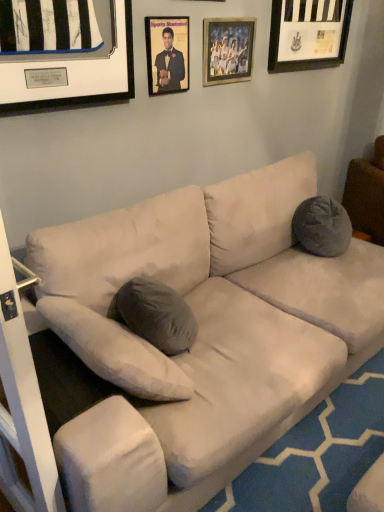
Where is `gray fabric pillow at right`? gray fabric pillow at right is located at coordinates (366, 195).

The width and height of the screenshot is (384, 512). What are the coordinates of `black matte picture frame at upper right, which is the 3th picture frame from left to right` in the screenshot? It's located at (308, 34).

Between matte black frame at upper center, which is the 3th picture frame in right-to-left order, and wooden picture frame at upper center, the second picture frame positioned from the left, which one has more height?

With more height is matte black frame at upper center, which is the 3th picture frame in right-to-left order.

In the scene shown: Who is more distant, matte black frame at upper center, which is the 3th picture frame in right-to-left order, or wooden picture frame at upper center, which appears as the second picture frame when viewed from the right?

wooden picture frame at upper center, which appears as the second picture frame when viewed from the right, is further away from the camera.

Considering the sizes of objects matte black frame at upper center, which is the 3th picture frame in right-to-left order, and wooden picture frame at upper center, the second picture frame positioned from the left, in the image provided, who is thinner, matte black frame at upper center, which is the 3th picture frame in right-to-left order, or wooden picture frame at upper center, the second picture frame positioned from the left,?

Thinner between the two is wooden picture frame at upper center, the second picture frame positioned from the left.

Can we say matte black frame at upper center, which ranks as the 1th picture frame in left-to-right order, lies outside wooden picture frame at upper center, the second picture frame positioned from the left?

Yes, matte black frame at upper center, which ranks as the 1th picture frame in left-to-right order, is outside of wooden picture frame at upper center, the second picture frame positioned from the left.

Is gray fabric pillow at right at the left side of matte black frame at upper center, which ranks as the 1th picture frame in left-to-right order?

No.

From a real-world perspective, is gray fabric pillow at right on top of matte black frame at upper center, which ranks as the 1th picture frame in left-to-right order?

No, from a real-world perspective, gray fabric pillow at right is not above matte black frame at upper center, which ranks as the 1th picture frame in left-to-right order.

What's the angular difference between gray fabric pillow at right and matte black frame at upper center, which ranks as the 1th picture frame in left-to-right order,'s facing directions?

The angle between the facing direction of gray fabric pillow at right and the facing direction of matte black frame at upper center, which ranks as the 1th picture frame in left-to-right order, is 32.7 degrees.

Would you say gray fabric pillow at right is outside matte black frame at upper center, which ranks as the 1th picture frame in left-to-right order?

Absolutely, gray fabric pillow at right is external to matte black frame at upper center, which ranks as the 1th picture frame in left-to-right order.

Is gray fabric pillow at right oriented away from wooden picture frame at upper center, the second picture frame positioned from the left?

No, wooden picture frame at upper center, the second picture frame positioned from the left, is not at the back of gray fabric pillow at right.

Is gray fabric pillow at right inside the boundaries of wooden picture frame at upper center, which appears as the second picture frame when viewed from the right, or outside?

gray fabric pillow at right exists outside the volume of wooden picture frame at upper center, which appears as the second picture frame when viewed from the right.

Which of these two, gray fabric pillow at right or wooden picture frame at upper center, the second picture frame positioned from the left, is wider?

gray fabric pillow at right.

Based on the photo, is black matte picture frame at upper right, which ranks as the 1th picture frame in right-to-left order, in contact with wooden picture frame at upper center, the second picture frame positioned from the left?

They are not placed beside each other.

Is black matte picture frame at upper right, which ranks as the 1th picture frame in right-to-left order, taller than wooden picture frame at upper center, which appears as the second picture frame when viewed from the right?

Indeed, black matte picture frame at upper right, which ranks as the 1th picture frame in right-to-left order, has a greater height compared to wooden picture frame at upper center, which appears as the second picture frame when viewed from the right.

Where is `the 1st picture frame to the left of the black matte picture frame at upper right, which is the 3th picture frame from left to right, starting your count from the anchor`? This screenshot has width=384, height=512. the 1st picture frame to the left of the black matte picture frame at upper right, which is the 3th picture frame from left to right, starting your count from the anchor is located at coordinates (227, 50).

In terms of height, does matte black frame at upper center, which ranks as the 1th picture frame in left-to-right order, look taller or shorter compared to gray fabric pillow at right?

Considering their sizes, matte black frame at upper center, which ranks as the 1th picture frame in left-to-right order, has less height than gray fabric pillow at right.

The width and height of the screenshot is (384, 512). There is a gray fabric pillow at right. Find the location of `the 1st picture frame above it (from the image's perspective)`. the 1st picture frame above it (from the image's perspective) is located at coordinates (167, 54).

Does matte black frame at upper center, which ranks as the 1th picture frame in left-to-right order, have a lesser width compared to gray fabric pillow at right?

Yes.

In the scene shown: Does matte black frame at upper center, which is the 3th picture frame in right-to-left order, turn towards gray fabric pillow at right?

No, matte black frame at upper center, which is the 3th picture frame in right-to-left order, is not turned towards gray fabric pillow at right.

From a real-world perspective, is matte black frame at upper center, which ranks as the 1th picture frame in left-to-right order, physically located above or below black matte picture frame at upper right, which is the 3th picture frame from left to right?

From a real-world perspective, matte black frame at upper center, which ranks as the 1th picture frame in left-to-right order, is physically below black matte picture frame at upper right, which is the 3th picture frame from left to right.

Can you tell me how much matte black frame at upper center, which is the 3th picture frame in right-to-left order, and black matte picture frame at upper right, which is the 3th picture frame from left to right, differ in facing direction?

The angle between the facing direction of matte black frame at upper center, which is the 3th picture frame in right-to-left order, and the facing direction of black matte picture frame at upper right, which is the 3th picture frame from left to right, is 0.00786 degrees.

Is matte black frame at upper center, which ranks as the 1th picture frame in left-to-right order, oriented towards black matte picture frame at upper right, which ranks as the 1th picture frame in right-to-left order?

No, matte black frame at upper center, which ranks as the 1th picture frame in left-to-right order, is not oriented towards black matte picture frame at upper right, which ranks as the 1th picture frame in right-to-left order.

Is matte black frame at upper center, which ranks as the 1th picture frame in left-to-right order, taller or shorter than black matte picture frame at upper right, which is the 3th picture frame from left to right?

Clearly, matte black frame at upper center, which ranks as the 1th picture frame in left-to-right order, is shorter compared to black matte picture frame at upper right, which is the 3th picture frame from left to right.

Are wooden picture frame at upper center, the second picture frame positioned from the left, and black matte picture frame at upper right, which is the 3th picture frame from left to right, beside each other?

wooden picture frame at upper center, the second picture frame positioned from the left, and black matte picture frame at upper right, which is the 3th picture frame from left to right, are clearly separated.

Can black matte picture frame at upper right, which is the 3th picture frame from left to right, be found inside wooden picture frame at upper center, which appears as the second picture frame when viewed from the right?

No.

Visually, is wooden picture frame at upper center, the second picture frame positioned from the left, positioned to the left or to the right of black matte picture frame at upper right, which is the 3th picture frame from left to right?

→ wooden picture frame at upper center, the second picture frame positioned from the left, is positioned on black matte picture frame at upper right, which is the 3th picture frame from left to right,'s left side.

This screenshot has height=512, width=384. I want to click on picture frame lying in front of the wooden picture frame at upper center, the second picture frame positioned from the left, so click(x=167, y=54).

You are a GUI agent. You are given a task and a screenshot of the screen. Output one action in this format:
    pyautogui.click(x=<x>, y=<y>)
    Task: Click on the 3rd picture frame to the left when counting from the gray fabric pillow at right
    The image size is (384, 512).
    Given the screenshot: What is the action you would take?
    pyautogui.click(x=167, y=54)

Which object lies further to the anchor point matte black frame at upper center, which is the 3th picture frame in right-to-left order, black matte picture frame at upper right, which ranks as the 1th picture frame in right-to-left order, or wooden picture frame at upper center, which appears as the second picture frame when viewed from the right?

black matte picture frame at upper right, which ranks as the 1th picture frame in right-to-left order, is positioned further to the anchor matte black frame at upper center, which is the 3th picture frame in right-to-left order.

Looking at the image, which one is located further to matte black frame at upper center, which ranks as the 1th picture frame in left-to-right order, wooden picture frame at upper center, which appears as the second picture frame when viewed from the right, or gray fabric pillow at right?

gray fabric pillow at right is positioned further to the anchor matte black frame at upper center, which ranks as the 1th picture frame in left-to-right order.

Based on their spatial positions, is gray fabric pillow at right or black matte picture frame at upper right, which is the 3th picture frame from left to right, further from matte black frame at upper center, which ranks as the 1th picture frame in left-to-right order?

Among the two, gray fabric pillow at right is located further to matte black frame at upper center, which ranks as the 1th picture frame in left-to-right order.

Based on their spatial positions, is matte black frame at upper center, which ranks as the 1th picture frame in left-to-right order, or gray fabric pillow at right further from wooden picture frame at upper center, which appears as the second picture frame when viewed from the right?

Among the two, gray fabric pillow at right is located further to wooden picture frame at upper center, which appears as the second picture frame when viewed from the right.

Considering their positions, is black matte picture frame at upper right, which ranks as the 1th picture frame in right-to-left order, positioned further to wooden picture frame at upper center, which appears as the second picture frame when viewed from the right, than matte black frame at upper center, which is the 3th picture frame in right-to-left order?

black matte picture frame at upper right, which ranks as the 1th picture frame in right-to-left order, is further to wooden picture frame at upper center, which appears as the second picture frame when viewed from the right.

Estimate the real-world distances between objects in this image. Which object is closer to black matte picture frame at upper right, which ranks as the 1th picture frame in right-to-left order, wooden picture frame at upper center, which appears as the second picture frame when viewed from the right, or gray fabric pillow at right?

Based on the image, wooden picture frame at upper center, which appears as the second picture frame when viewed from the right, appears to be nearer to black matte picture frame at upper right, which ranks as the 1th picture frame in right-to-left order.

From the image, which object appears to be farther from gray fabric pillow at right, matte black frame at upper center, which is the 3th picture frame in right-to-left order, or black matte picture frame at upper right, which ranks as the 1th picture frame in right-to-left order?

matte black frame at upper center, which is the 3th picture frame in right-to-left order, lies further to gray fabric pillow at right than the other object.

Estimate the real-world distances between objects in this image. Which object is closer to gray fabric pillow at right, wooden picture frame at upper center, which appears as the second picture frame when viewed from the right, or black matte picture frame at upper right, which ranks as the 1th picture frame in right-to-left order?

black matte picture frame at upper right, which ranks as the 1th picture frame in right-to-left order, is positioned closer to the anchor gray fabric pillow at right.

Where is `picture frame between matte black frame at upper center, which is the 3th picture frame in right-to-left order, and black matte picture frame at upper right, which is the 3th picture frame from left to right, from left to right`? This screenshot has height=512, width=384. picture frame between matte black frame at upper center, which is the 3th picture frame in right-to-left order, and black matte picture frame at upper right, which is the 3th picture frame from left to right, from left to right is located at coordinates (227, 50).

Image resolution: width=384 pixels, height=512 pixels. What are the coordinates of `picture frame between wooden picture frame at upper center, which appears as the second picture frame when viewed from the right, and gray fabric pillow at right` in the screenshot? It's located at (308, 34).